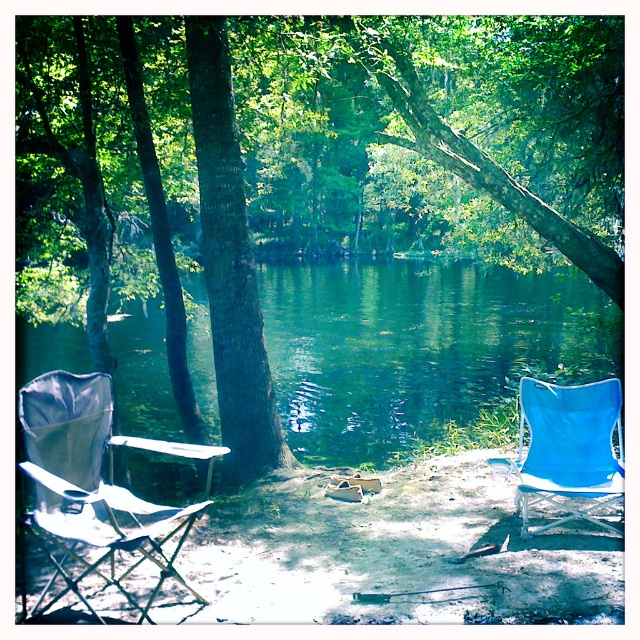
Question: Based on their relative distances, which object is nearer to the green translucent water at center?

Choices:
 (A) blue fabric chair at right
 (B) green rough bark tree at center
 (C) green textured tree trunk at center

Answer: (C)

Question: Is green textured tree trunk at center thinner than silver metallic beach chair at left?

Choices:
 (A) yes
 (B) no

Answer: (B)

Question: Which point is farther from the camera taking this photo?

Choices:
 (A) (224, 296)
 (B) (68, 467)
 (C) (397, 348)
 (D) (550, 396)

Answer: (C)

Question: Is green rough bark tree at center wider than blue fabric chair at right?

Choices:
 (A) yes
 (B) no

Answer: (B)

Question: Can you confirm if green translucent water at center is positioned above blue fabric chair at right?

Choices:
 (A) no
 (B) yes

Answer: (B)

Question: Which point appears closest to the camera in this image?

Choices:
 (A) (90, 244)
 (B) (260, 369)
 (C) (35, 426)
 (D) (584, 458)

Answer: (C)